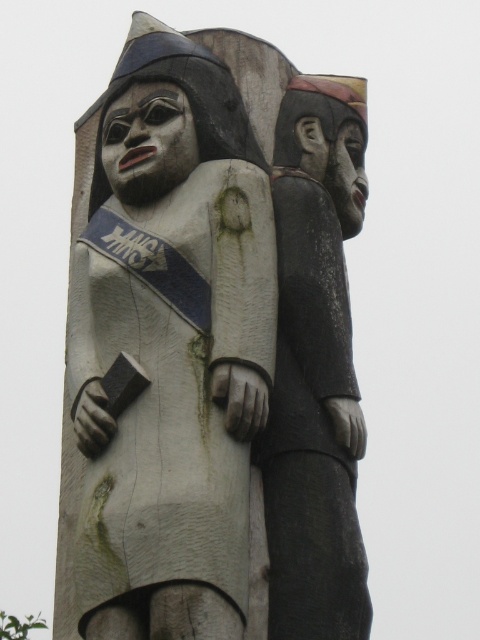
Which is above, wooden totem pole at center or dark gray wood figure at right?

wooden totem pole at center is above.

Can you confirm if wooden totem pole at center is positioned to the left of dark gray wood figure at right?

Correct, you'll find wooden totem pole at center to the left of dark gray wood figure at right.

What do you see at coordinates (166, 348) in the screenshot?
I see `wooden totem pole at center` at bounding box center [166, 348].

What are the coordinates of `wooden totem pole at center` in the screenshot? It's located at tap(166, 348).